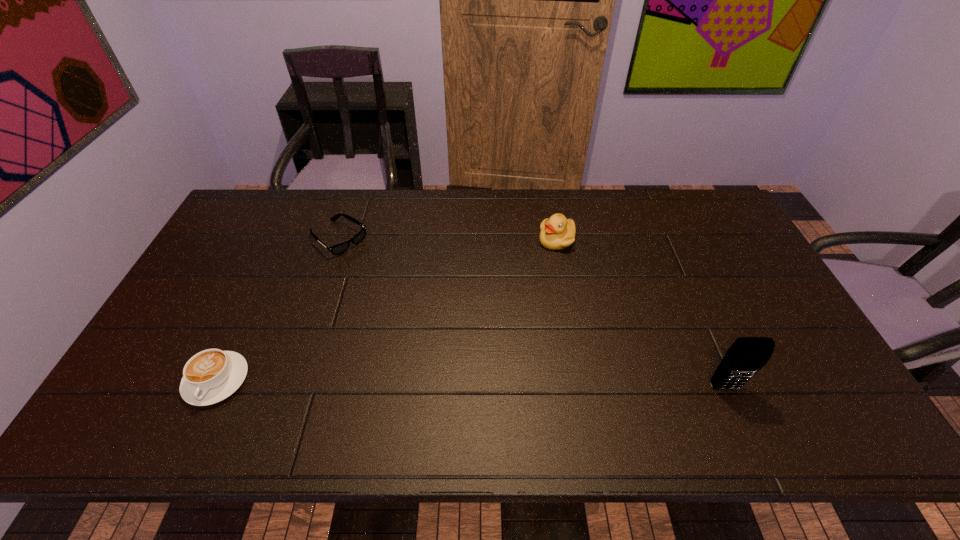
In order to click on vacant spot on the desktop that is between the cappuccino and the rightmost object and is positioned on the front-facing side of the sunglasses in this screenshot , I will do `click(533, 384)`.

Locate an element on the screen. free space on the desktop that is between the leftmost object and the cellular telephone and is positioned on the front-facing side of the third shortest object is located at coordinates (481, 384).